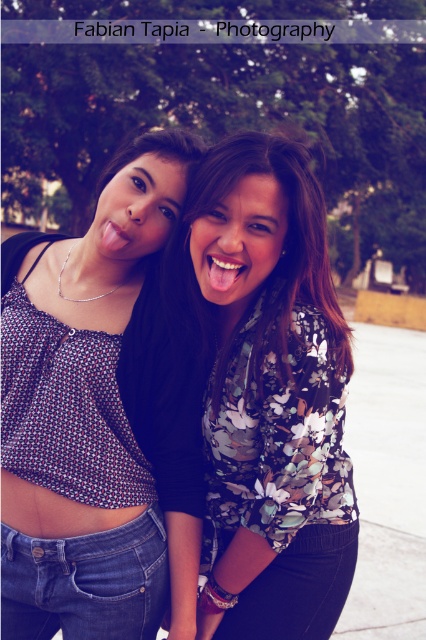
Question: Can you confirm if floral-patterned shirt at center is wider than printed fabric blouse at center?

Choices:
 (A) no
 (B) yes

Answer: (A)

Question: Among these points, which one is nearest to the camera?

Choices:
 (A) (253, 598)
 (B) (72, 435)

Answer: (B)

Question: Does floral-patterned shirt at center have a lesser width compared to printed fabric blouse at center?

Choices:
 (A) no
 (B) yes

Answer: (B)

Question: Which object appears farthest from the camera in this image?

Choices:
 (A) printed fabric blouse at center
 (B) floral-patterned shirt at center

Answer: (A)

Question: Can you confirm if floral-patterned shirt at center is wider than printed fabric blouse at center?

Choices:
 (A) no
 (B) yes

Answer: (A)